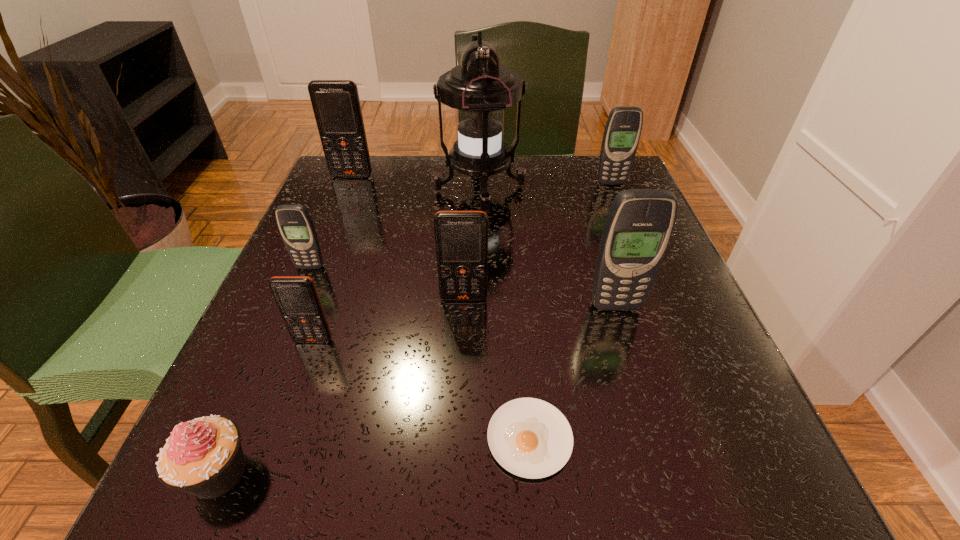
Identify the location of black lantern. (479, 89).

The image size is (960, 540). What are the coordinates of `the tallest object` in the screenshot? It's located at (479, 89).

You are a GUI agent. You are given a task and a screenshot of the screen. Output one action in this format:
    pyautogui.click(x=<x>, y=<y>)
    Task: Click on the farthest orange cellular telephone
    The height and width of the screenshot is (540, 960).
    Given the screenshot: What is the action you would take?
    pyautogui.click(x=336, y=104)

Image resolution: width=960 pixels, height=540 pixels. I want to click on the biggest orange cellular telephone, so coord(336,104).

The width and height of the screenshot is (960, 540). I want to click on the nearest gray cellular telephone, so click(638, 228).

The height and width of the screenshot is (540, 960). Identify the location of the second biggest gray cellular telephone. (623, 128).

This screenshot has width=960, height=540. In order to click on the fifth nearest cellular telephone in this screenshot , I will do `click(623, 128)`.

Where is `the second farthest orange cellular telephone`? Image resolution: width=960 pixels, height=540 pixels. the second farthest orange cellular telephone is located at coordinates (461, 237).

Identify the location of the second biggest orange cellular telephone. The image size is (960, 540). (461, 237).

Locate an element on the screen. The image size is (960, 540). the third nearest object is located at coordinates (297, 298).